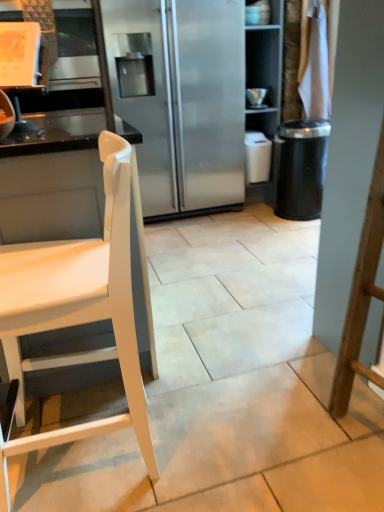
Question: From a real-world perspective, is black textured trash can at right physically below white matte chair at left?

Choices:
 (A) yes
 (B) no

Answer: (A)

Question: Does black textured trash can at right have a larger size compared to white matte chair at left?

Choices:
 (A) yes
 (B) no

Answer: (B)

Question: Does black textured trash can at right appear on the right side of white matte chair at left?

Choices:
 (A) yes
 (B) no

Answer: (A)

Question: Considering the relative sizes of black textured trash can at right and white matte chair at left in the image provided, is black textured trash can at right smaller than white matte chair at left?

Choices:
 (A) no
 (B) yes

Answer: (B)

Question: Is black textured trash can at right outside white matte chair at left?

Choices:
 (A) no
 (B) yes

Answer: (B)

Question: Is black textured trash can at right wider than white matte chair at left?

Choices:
 (A) no
 (B) yes

Answer: (A)

Question: From a real-world perspective, is white matte chair at left positioned over black textured trash can at right based on gravity?

Choices:
 (A) no
 (B) yes

Answer: (B)

Question: Is the position of white matte chair at left less distant than that of black textured trash can at right?

Choices:
 (A) yes
 (B) no

Answer: (A)

Question: Is white matte chair at left far from black textured trash can at right?

Choices:
 (A) no
 (B) yes

Answer: (B)

Question: From a real-world perspective, is white matte chair at left located beneath black textured trash can at right?

Choices:
 (A) yes
 (B) no

Answer: (B)

Question: From the image's perspective, is white matte chair at left located above black textured trash can at right?

Choices:
 (A) yes
 (B) no

Answer: (B)

Question: Is the position of white matte chair at left more distant than that of black textured trash can at right?

Choices:
 (A) no
 (B) yes

Answer: (A)

Question: Looking at their shapes, would you say white matte chair at left is wider or thinner than black textured trash can at right?

Choices:
 (A) wide
 (B) thin

Answer: (A)